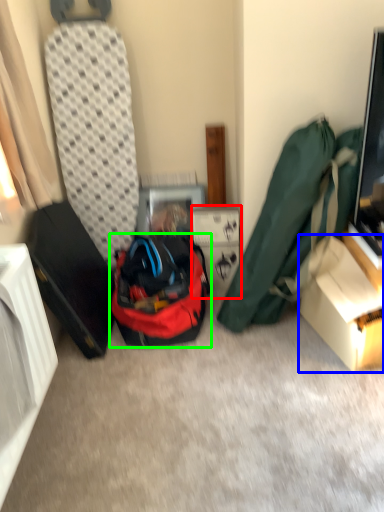
Question: Which is nearer to the cardboard box (highlighted by a red box)? box (highlighted by a blue box) or backpack (highlighted by a green box).

Choices:
 (A) box
 (B) backpack

Answer: (B)